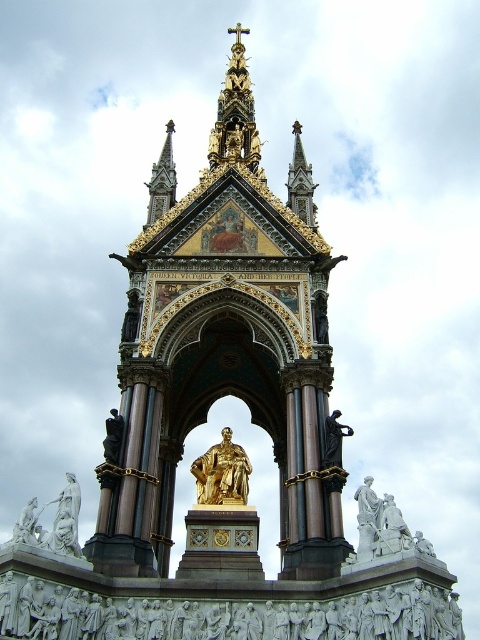
Can you confirm if gold polished statue at center is thinner than polished bronze statue at center-right?

No, gold polished statue at center is not thinner than polished bronze statue at center-right.

Does point (211, 476) come behind point (324, 467)?

Yes.

This screenshot has height=640, width=480. Find the location of `gold polished statue at center`. gold polished statue at center is located at coordinates (222, 472).

Does point (333, 460) come closer to viewer compared to point (36, 538)?

No, it is behind (36, 538).

The height and width of the screenshot is (640, 480). What do you see at coordinates (334, 440) in the screenshot?
I see `polished bronze statue at center-right` at bounding box center [334, 440].

You are a GUI agent. You are given a task and a screenshot of the screen. Output one action in this format:
    pyautogui.click(x=<x>, y=<y>)
    Task: Click on the polished bronze statue at center-right
    
    Given the screenshot: What is the action you would take?
    click(334, 440)

Can you confirm if gold polished statue at center is wider than white marble statue at lower left?

No.

Does gold polished statue at center have a lesser width compared to white marble statue at lower left?

Yes, gold polished statue at center is thinner than white marble statue at lower left.

Is point (218, 449) positioned after point (28, 540)?

Yes, point (218, 449) is farther from viewer.

Locate an element on the screen. Image resolution: width=480 pixels, height=640 pixels. gold polished statue at center is located at coordinates (222, 472).